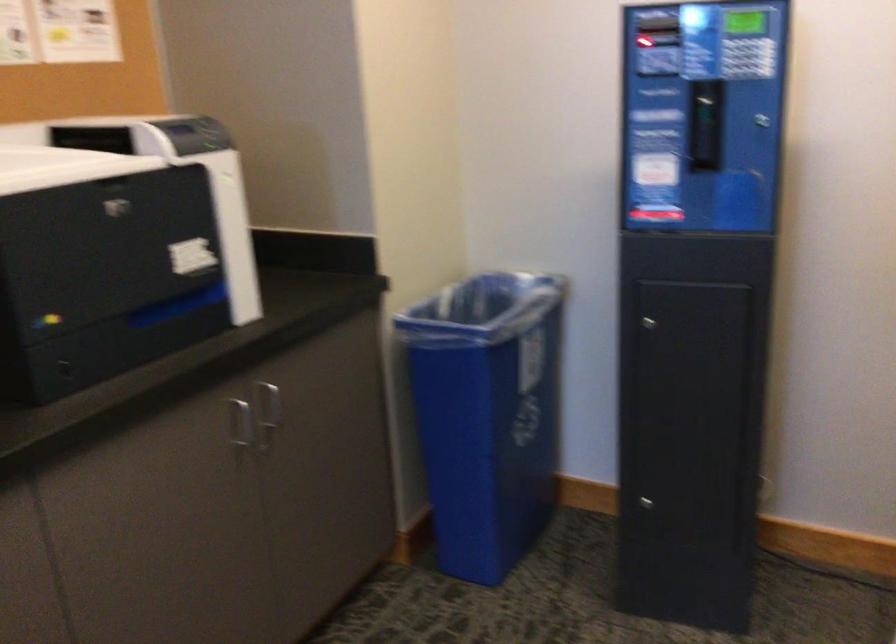
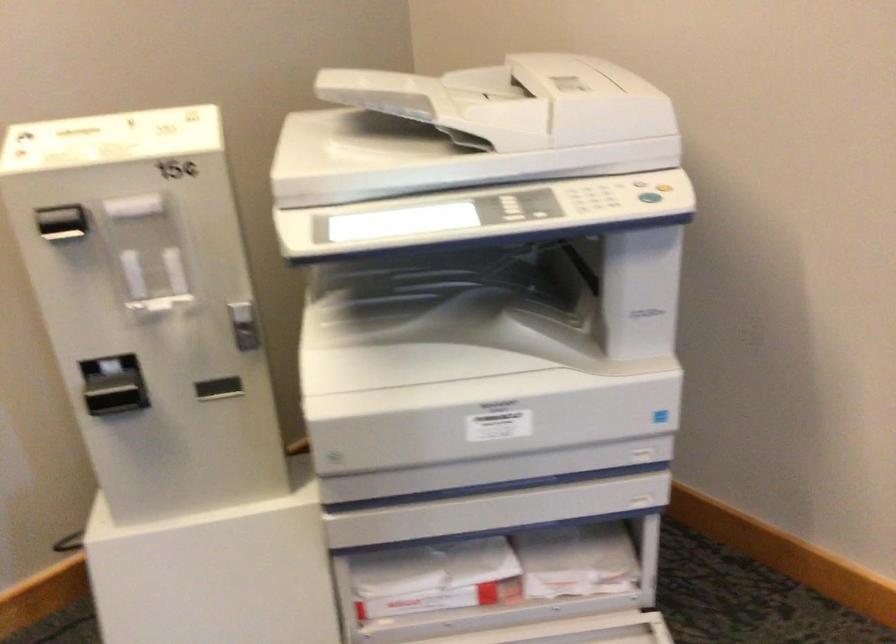
Based on the continuous images, in which direction is the camera rotating?

The camera's rotation is toward right-down.